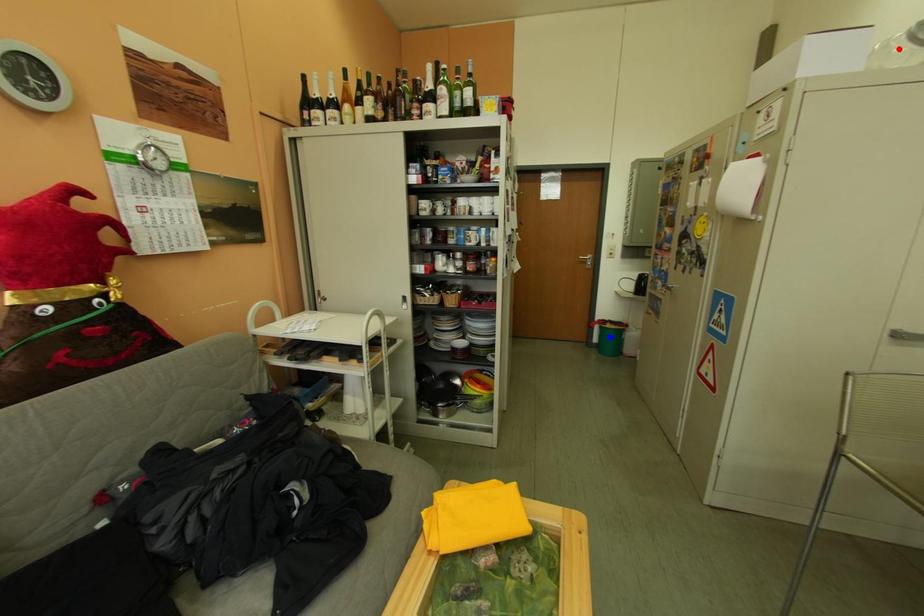
Question: In the image, two points are highlighted. Which point is nearer to the camera? Reply with the corresponding letter.

Choices:
 (A) blue point
 (B) red point

Answer: (B)